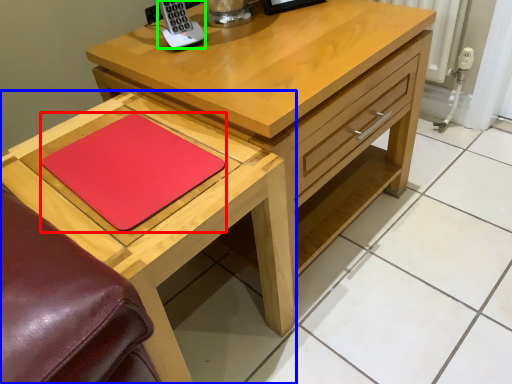
Question: Which is nearer to the pad (highlighted by a red box)? table (highlighted by a blue box) or appliance (highlighted by a green box).

Choices:
 (A) table
 (B) appliance

Answer: (A)